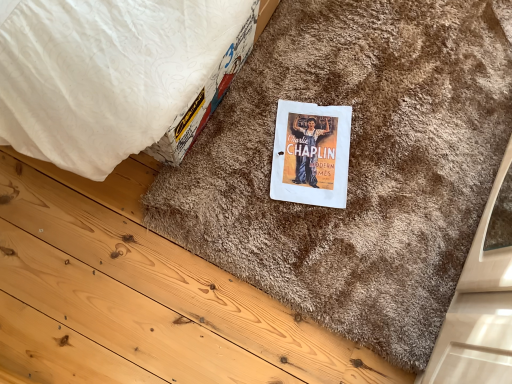
The height and width of the screenshot is (384, 512). I want to click on brown shaggy doormat at center, so click(355, 165).

This screenshot has height=384, width=512. What do you see at coordinates (355, 165) in the screenshot?
I see `brown shaggy doormat at center` at bounding box center [355, 165].

What do you see at coordinates (311, 154) in the screenshot? I see `white paper at center` at bounding box center [311, 154].

Where is `white paper at center`? This screenshot has height=384, width=512. white paper at center is located at coordinates (311, 154).

Locate an element on the screen. The height and width of the screenshot is (384, 512). brown shaggy doormat at center is located at coordinates (355, 165).

Considering the relative positions of brown shaggy doormat at center and white paper at center in the image provided, is brown shaggy doormat at center to the left or to the right of white paper at center?

brown shaggy doormat at center is to the right of white paper at center.

Does brown shaggy doormat at center lie behind white paper at center?

No, the depth of brown shaggy doormat at center is less than that of white paper at center.

Does point (371, 34) come behind point (290, 123)?

Yes, it is behind point (290, 123).

From the image's perspective, which is below, brown shaggy doormat at center or white paper at center?

white paper at center, from the image's perspective.

From a real-world perspective, which object stands above the other?

In real-world perspective, brown shaggy doormat at center is above.

Is brown shaggy doormat at center wider or thinner than white paper at center?

Considering their sizes, brown shaggy doormat at center looks broader than white paper at center.

Considering the sizes of objects brown shaggy doormat at center and white paper at center in the image provided, who is shorter, brown shaggy doormat at center or white paper at center?

white paper at center.

Is brown shaggy doormat at center bigger than white paper at center?

Indeed, brown shaggy doormat at center has a larger size compared to white paper at center.

Is brown shaggy doormat at center not inside white paper at center?

Yes, brown shaggy doormat at center is not within white paper at center.

Are brown shaggy doormat at center and white paper at center making contact?

brown shaggy doormat at center is not next to white paper at center, and they're not touching.

Is brown shaggy doormat at center looking in the opposite direction of white paper at center?

No, brown shaggy doormat at center is not facing away from white paper at center.

How many degrees apart are the facing directions of brown shaggy doormat at center and white paper at center?

The facing directions of brown shaggy doormat at center and white paper at center are 158 degrees apart.

At what (x,y) coordinates should I click in order to perform the action: click on doormat that appears above the white paper at center (from a real-world perspective). Please return your answer as a coordinate pair (x, y). The image size is (512, 384). Looking at the image, I should click on (355, 165).

Which is more to the right, white paper at center or brown shaggy doormat at center?

Positioned to the right is brown shaggy doormat at center.

Considering their positions, is white paper at center located in front of or behind brown shaggy doormat at center?

Clearly, white paper at center is behind brown shaggy doormat at center.

Considering the positions of point (341, 206) and point (296, 237), is point (341, 206) closer or farther from the camera than point (296, 237)?

Point (341, 206) is positioned farther from the camera compared to point (296, 237).

From the image's perspective, which one is positioned higher, white paper at center or brown shaggy doormat at center?

brown shaggy doormat at center appears higher in the image.

From a real-world perspective, who is located higher, white paper at center or brown shaggy doormat at center?

In real-world perspective, brown shaggy doormat at center is above.

Between white paper at center and brown shaggy doormat at center, which one has larger width?

brown shaggy doormat at center is wider.

Which of these two, white paper at center or brown shaggy doormat at center, stands shorter?

A: With less height is white paper at center.

Considering the relative sizes of white paper at center and brown shaggy doormat at center in the image provided, is white paper at center bigger than brown shaggy doormat at center?

No.

Is white paper at center situated inside brown shaggy doormat at center or outside?

The correct answer is: inside.

In the scene shown: Are white paper at center and brown shaggy doormat at center located far from each other?

No.

Is white paper at center oriented away from brown shaggy doormat at center?

Yes, white paper at center is facing away from brown shaggy doormat at center.

How many degrees apart are the facing directions of white paper at center and brown shaggy doormat at center?

They differ by 158 degrees in their facing directions.

At what (x,y) coordinates should I click in order to perform the action: click on doormat in front of the white paper at center. Please return your answer as a coordinate pair (x, y). Looking at the image, I should click on (355, 165).

Where is `doormat on the right of white paper at center`? doormat on the right of white paper at center is located at coordinates (355, 165).

Locate an element on the screen. paperback book beneath the brown shaggy doormat at center (from a real-world perspective) is located at coordinates pos(311,154).